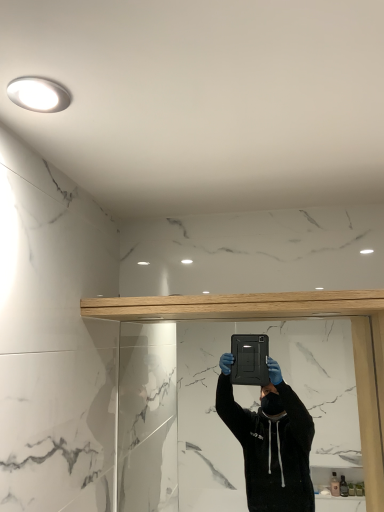
Question: Is black matte mirror at center to the right of white glossy light fixture at upper left from the viewer's perspective?

Choices:
 (A) no
 (B) yes

Answer: (B)

Question: Can you confirm if black matte mirror at center is shorter than white glossy light fixture at upper left?

Choices:
 (A) no
 (B) yes

Answer: (A)

Question: From the image's perspective, is black matte mirror at center over white glossy light fixture at upper left?

Choices:
 (A) no
 (B) yes

Answer: (A)

Question: Considering the relative sizes of black matte mirror at center and white glossy light fixture at upper left in the image provided, is black matte mirror at center bigger than white glossy light fixture at upper left?

Choices:
 (A) yes
 (B) no

Answer: (A)

Question: Can you confirm if black matte mirror at center is thinner than white glossy light fixture at upper left?

Choices:
 (A) yes
 (B) no

Answer: (A)

Question: Is black matte mirror at center inside the boundaries of light oak wood beam at upper center, or outside?

Choices:
 (A) outside
 (B) inside

Answer: (A)

Question: Visually, is black matte mirror at center positioned to the left or to the right of light oak wood beam at upper center?

Choices:
 (A) right
 (B) left

Answer: (A)

Question: From their relative heights in the image, would you say black matte mirror at center is taller or shorter than light oak wood beam at upper center?

Choices:
 (A) short
 (B) tall

Answer: (B)

Question: Considering the positions of black matte mirror at center and light oak wood beam at upper center in the image, is black matte mirror at center wider or thinner than light oak wood beam at upper center?

Choices:
 (A) wide
 (B) thin

Answer: (B)

Question: In the image, is light oak wood beam at upper center positioned in front of or behind white glossy light fixture at upper left?

Choices:
 (A) front
 (B) behind

Answer: (B)

Question: From the image's perspective, is light oak wood beam at upper center positioned above or below white glossy light fixture at upper left?

Choices:
 (A) below
 (B) above

Answer: (A)

Question: Do you think light oak wood beam at upper center is within white glossy light fixture at upper left, or outside of it?

Choices:
 (A) inside
 (B) outside

Answer: (B)

Question: From a real-world perspective, is light oak wood beam at upper center above or below white glossy light fixture at upper left?

Choices:
 (A) above
 (B) below

Answer: (B)

Question: Is white glossy light fixture at upper left taller or shorter than black matte mirror at center?

Choices:
 (A) short
 (B) tall

Answer: (A)

Question: In terms of width, does white glossy light fixture at upper left look wider or thinner when compared to black matte mirror at center?

Choices:
 (A) wide
 (B) thin

Answer: (A)